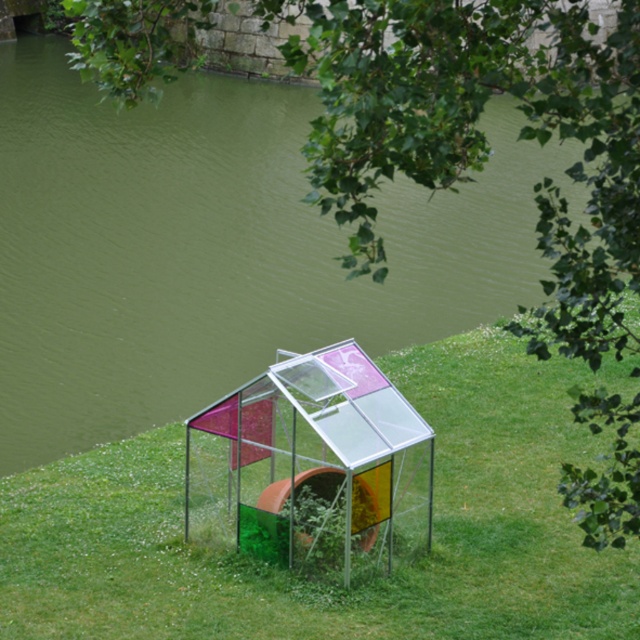
You are standing at the edge of the water and want to walk to the transparent plastic greenhouse at center. Which direction should you move relative to the green grass at center?

You should move to the left relative to the green grass at center to reach the transparent plastic greenhouse at center because the green grass at center is to the right of the greenhouse.